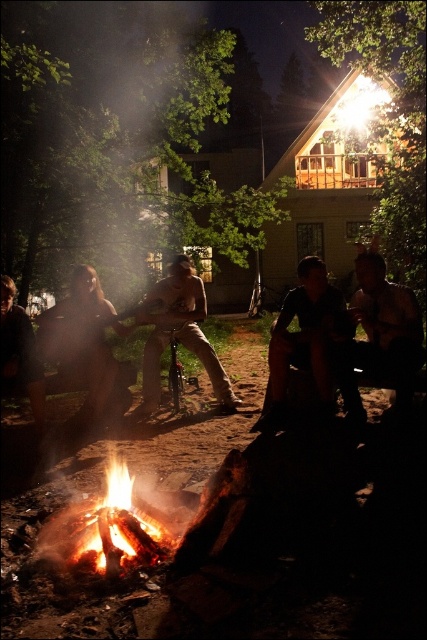
You are standing at the campfire and want to place the brown leather jacket at center onto a hook that is 14 feet away. Can the jacket reach the hook?

The brown leather jacket at center is 14.43 feet away from the hook, so it can reach the hook since 14.43 feet is slightly more than 14 feet.

You are a hiker who just arrived at the campsite. You see a brown leather jacket at center and a dark brown leather jacket at lower left. Which jacket is wider?

The brown leather jacket at center might be wider than dark brown leather jacket at lower left.

You are standing near the campfire in the scene and want to pick up both the brown leather jacket at center and the tan leather pants at center. Which item should you reach for first to grab the one closer to you?

The brown leather jacket at center is closer to the viewer than the tan leather pants at center, so you should reach for the brown leather jacket at center first.